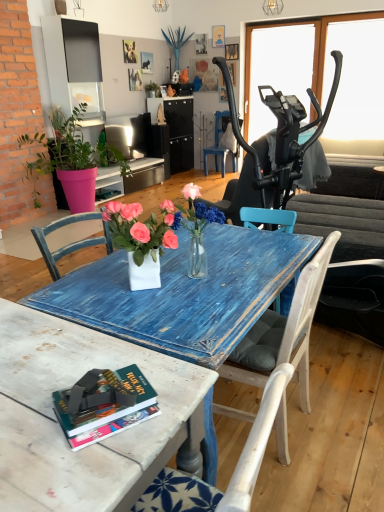
Locate an element on the screen. This screenshot has height=512, width=384. blank space situated above hardcover book at lower left (from a real-world perspective) is located at coordinates (110, 403).